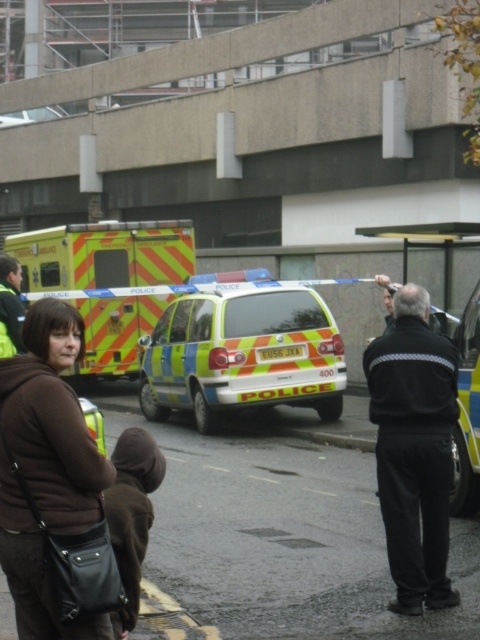
Question: Is yellow reflective ambulance at left thinner than yellow reflective van at center?

Choices:
 (A) yes
 (B) no

Answer: (B)

Question: Is reflective yellow and blue van at center closer to camera compared to dark brown leather jacket at lower left?

Choices:
 (A) yes
 (B) no

Answer: (B)

Question: Considering the real-world distances, which object is farthest from the yellow reflective van at center?

Choices:
 (A) black smooth jacket at center
 (B) brown fabric jacket at lower left
 (C) yellow reflective ambulance at left

Answer: (C)

Question: Which object is the farthest from the reflective yellow and blue van at center?

Choices:
 (A) yellow reflective ambulance at left
 (B) brown fabric jacket at lower left

Answer: (B)

Question: Can you confirm if yellow reflective ambulance at left is wider than dark brown leather jacket at lower left?

Choices:
 (A) yes
 (B) no

Answer: (A)

Question: Which point is closer to the camera taking this photo?

Choices:
 (A) (261, 369)
 (B) (4, 552)
 (C) (465, 429)
 (D) (431, 444)

Answer: (B)